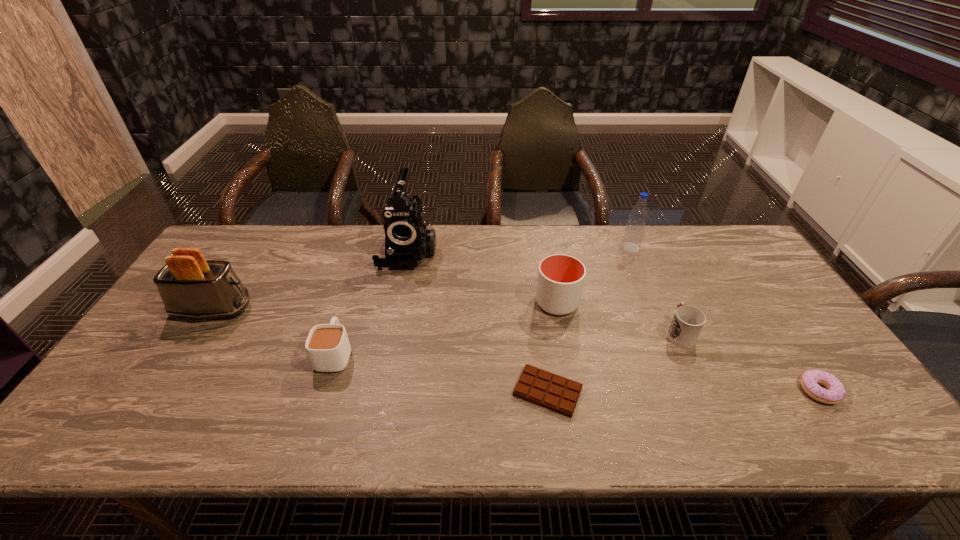
Where is `vacant space located 0.130m on the lens mount of the tallest object`? vacant space located 0.130m on the lens mount of the tallest object is located at coordinates (397, 301).

Locate an element on the screen. vacant area situated 0.190m on the left of the water bottle is located at coordinates (564, 248).

Image resolution: width=960 pixels, height=540 pixels. I want to click on free space located on the side of the leftmost object with the control lever, so click(372, 309).

Locate an element on the screen. This screenshot has width=960, height=540. vacant space located 0.120m on the back of the farthest cup is located at coordinates (550, 262).

You are a GUI agent. You are given a task and a screenshot of the screen. Output one action in this format:
    pyautogui.click(x=<x>, y=<y>)
    Task: Click on the vacant space situated on the side with the handle of the leftmost cup
    The image size is (960, 540).
    Given the screenshot: What is the action you would take?
    tap(348, 310)

Image resolution: width=960 pixels, height=540 pixels. Find the location of `blank area located 0.280m on the side with the handle of the leftmost cup`. blank area located 0.280m on the side with the handle of the leftmost cup is located at coordinates coord(362,267).

Locate an element on the screen. This screenshot has height=540, width=960. free space located on the side with the handle of the leftmost cup is located at coordinates (357, 284).

Locate an element on the screen. vacant space located 0.260m on the handle side of the rightmost cup is located at coordinates (647, 261).

I want to click on vacant region located on the handle side of the rightmost cup, so click(x=636, y=237).

The height and width of the screenshot is (540, 960). Identify the location of free space located on the handle side of the rightmost cup. (666, 304).